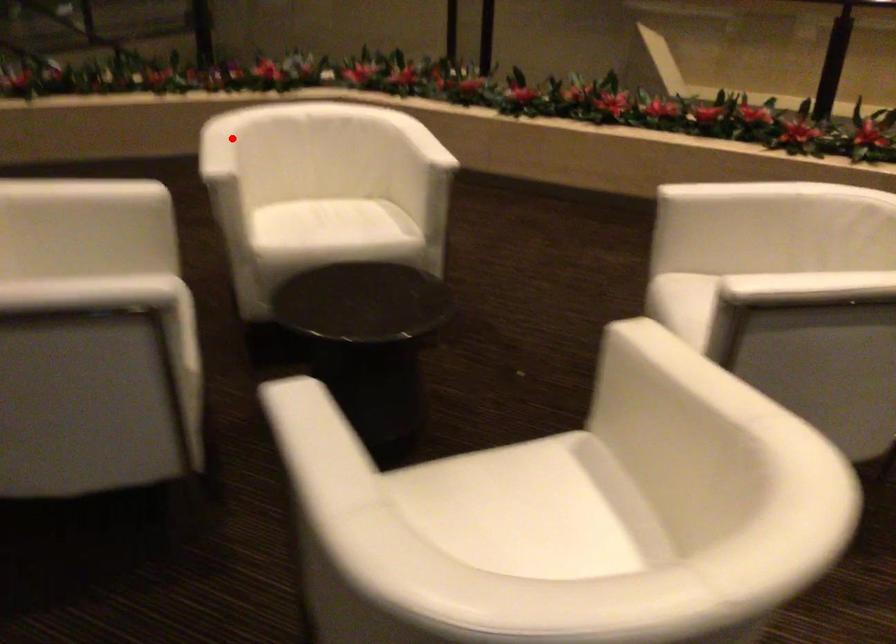
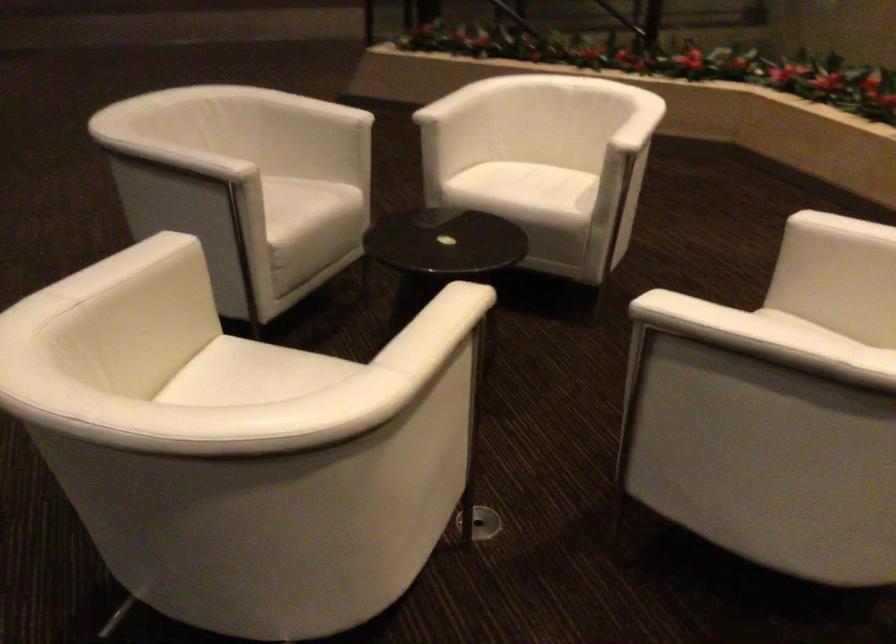
Question: I am providing you with two images of the same scene from different viewpoints. In image1, a red point is highlighted. Considering the same 3D point in image2, which of the following is correct?

Choices:
 (A) It is closer
 (B) It is farther

Answer: (B)